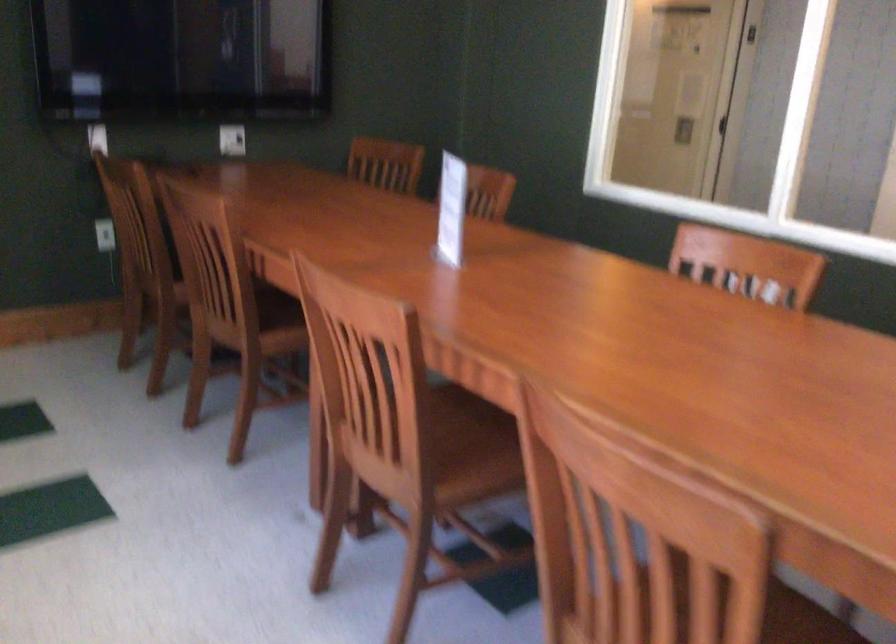
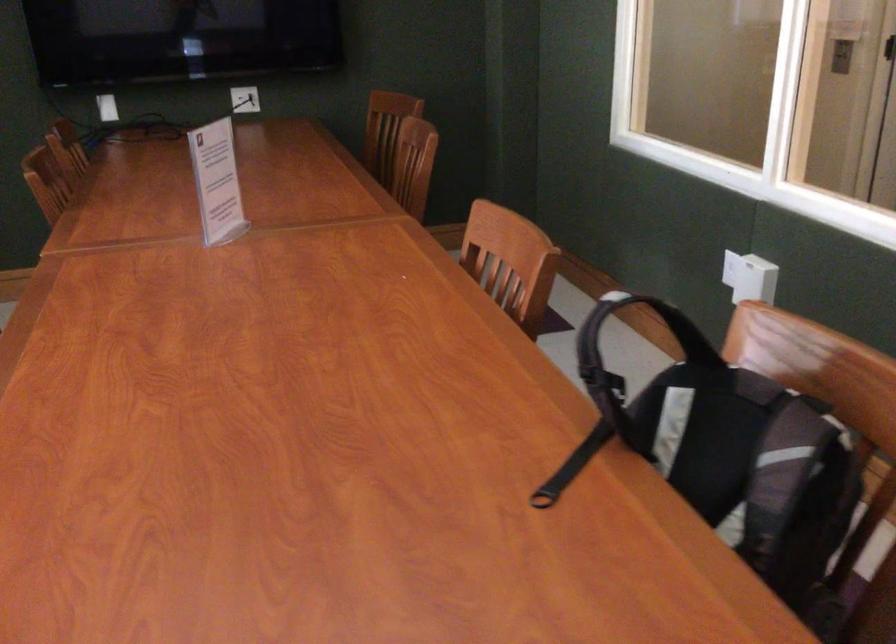
Locate, in the second image, the point that corresponds to pixel 234 142 in the first image.

(245, 99)